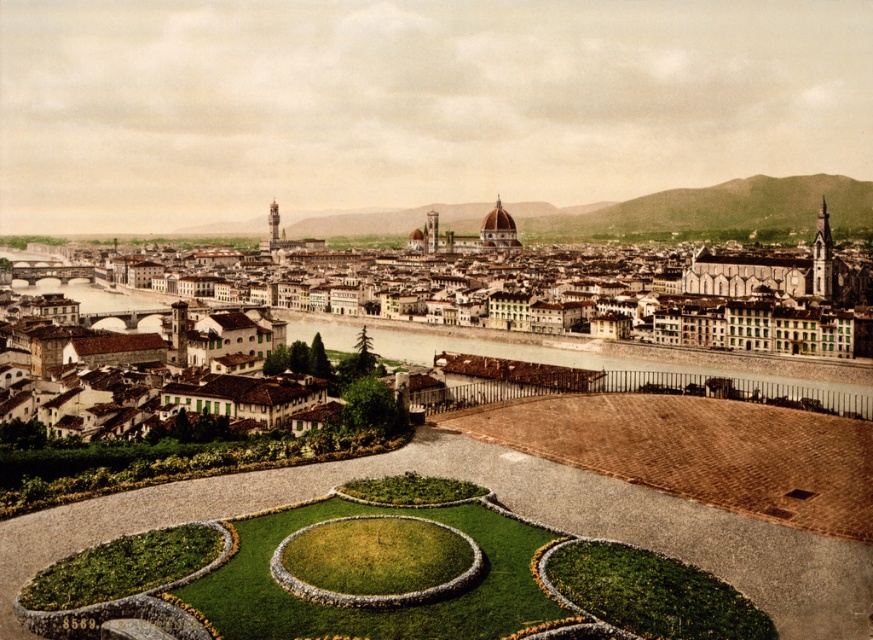
You are a tourist standing in the garden and want to take a photo of the brown stone buildings at center and the brown concrete river at center. Which object is located to the left of the other?

The brown stone buildings at center is positioned on the left side of brown concrete river at center.